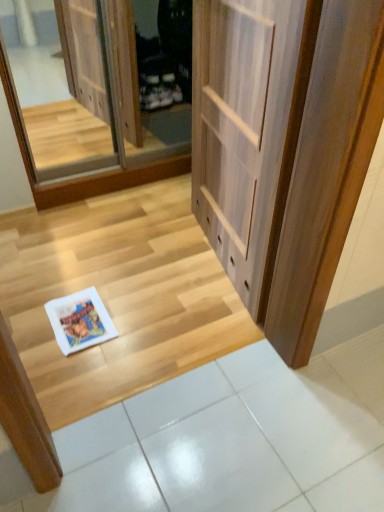
Find the location of `empty space that is ontop of wooden floor at lower left (from a real-world perspective)`. empty space that is ontop of wooden floor at lower left (from a real-world perspective) is located at coordinates (129, 275).